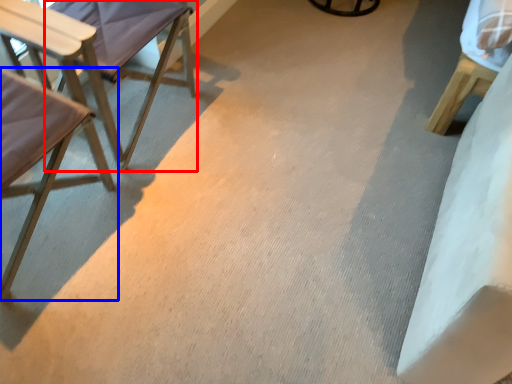
Question: Which of the following is the farthest to the observer, chair (highlighted by a red box) or chair (highlighted by a blue box)?

Choices:
 (A) chair
 (B) chair

Answer: (A)